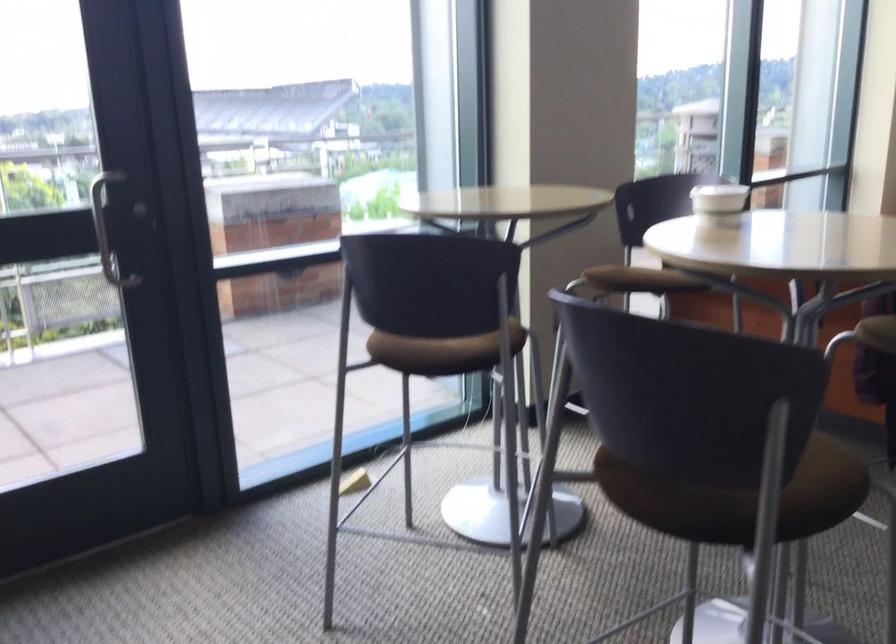
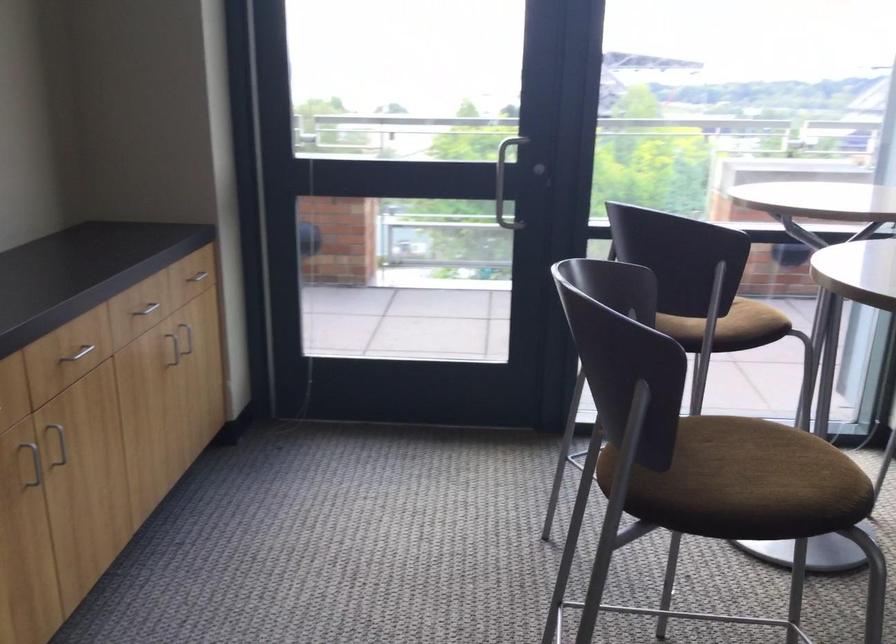
Find the pixel in the second image that matches point 768,474 in the first image.

(739, 482)